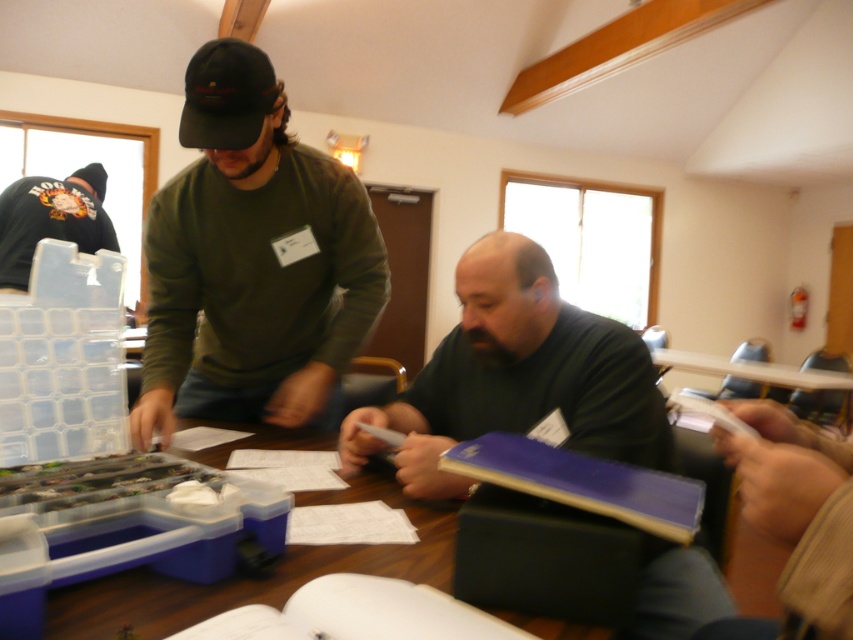
Is dark green sweater at center thinner than wooden table at center?

Incorrect, dark green sweater at center's width is not less than wooden table at center's.

Which is below, dark green sweater at center or wooden table at center?

wooden table at center is lower down.

Which is in front, point (485, 310) or point (587, 627)?

Point (587, 627) is more forward.

Locate an element on the screen. The width and height of the screenshot is (853, 640). dark green sweater at center is located at coordinates (517, 376).

Who is higher up, wooden table at center or dark green hoodie at upper left?

dark green hoodie at upper left is higher up.

Which of these two, wooden table at center or dark green hoodie at upper left, stands shorter?

Standing shorter between the two is wooden table at center.

Who is more forward, (x=281, y=580) or (x=36, y=228)?

Point (x=281, y=580) is in front.

Where is `wooden table at center`? wooden table at center is located at coordinates (260, 579).

Between dark green sweater at center and dark green hoodie at upper left, which one has more height?

Standing taller between the two is dark green hoodie at upper left.

Does dark green sweater at center lie behind dark green hoodie at upper left?

That is False.

Which is in front, point (622, 422) or point (67, 234)?

Point (622, 422) is in front.

Locate an element on the screen. dark green sweater at center is located at coordinates (517, 376).